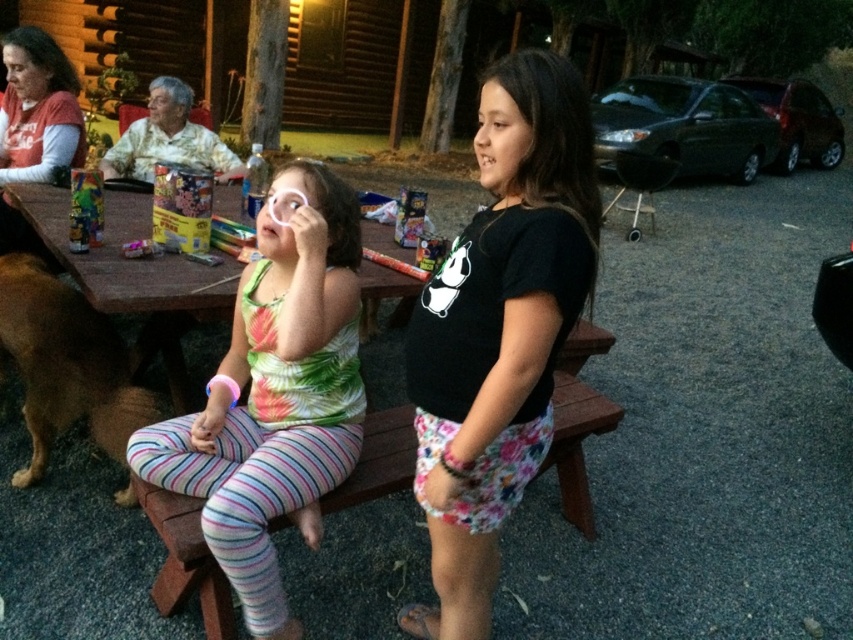
You are planning to hang two shirts on a clothesline in the backyard. The black cotton shirt at center and the hawaiian print shirt at upper left are both ready to be hung. Considering their sizes, which shirt should you place higher on the line to ensure they donot touch the ground?

The black cotton shirt at center has a greater height compared to the hawaiian print shirt at upper left, so you should hang the black cotton shirt at center higher on the clothesline to prevent it from touching the ground.

What is located at the coordinates point (135, 276) in the image?

The brown wooden picnic table at center is located at point (135, 276).

You are organizing a small outdoor event and need to place a decorative cloth over the brown wooden picnic table at center. The cloth you have is exactly the size of the black cotton shirt at center. Will the cloth be large enough to cover the entire table?

The black cotton shirt at center is smaller than the brown wooden picnic table at center, so the cloth will not be large enough to cover the entire table.